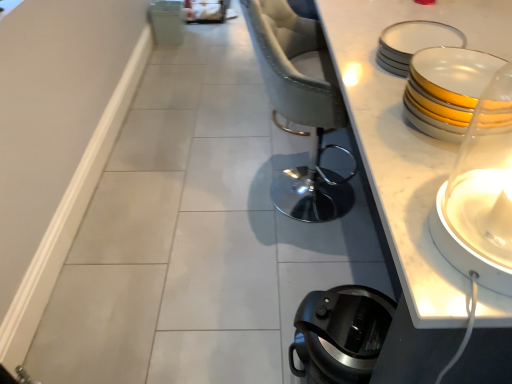
Locate an element on the screen. This screenshot has height=384, width=512. free spot below sleek gray fabric chair at center (from a real-world perspective) is located at coordinates (310, 180).